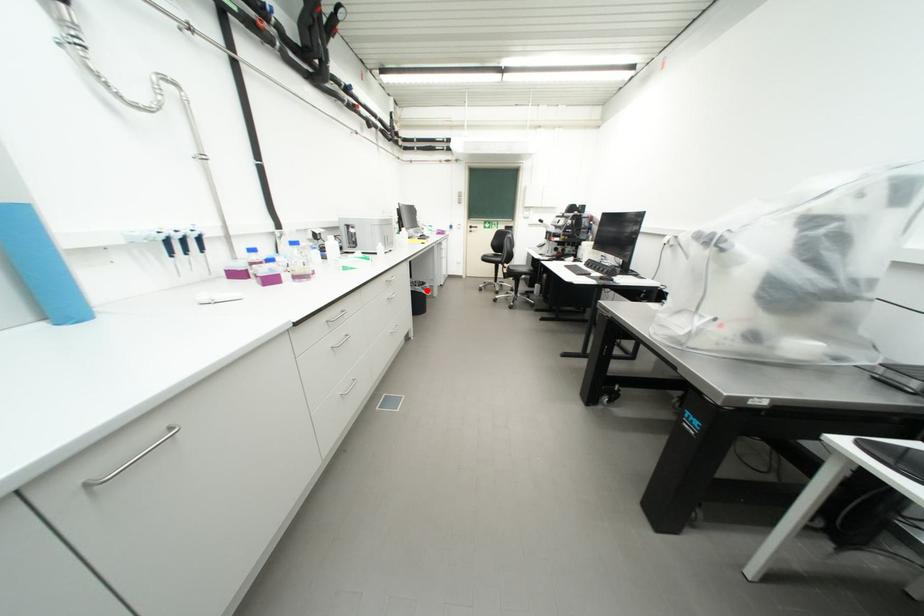
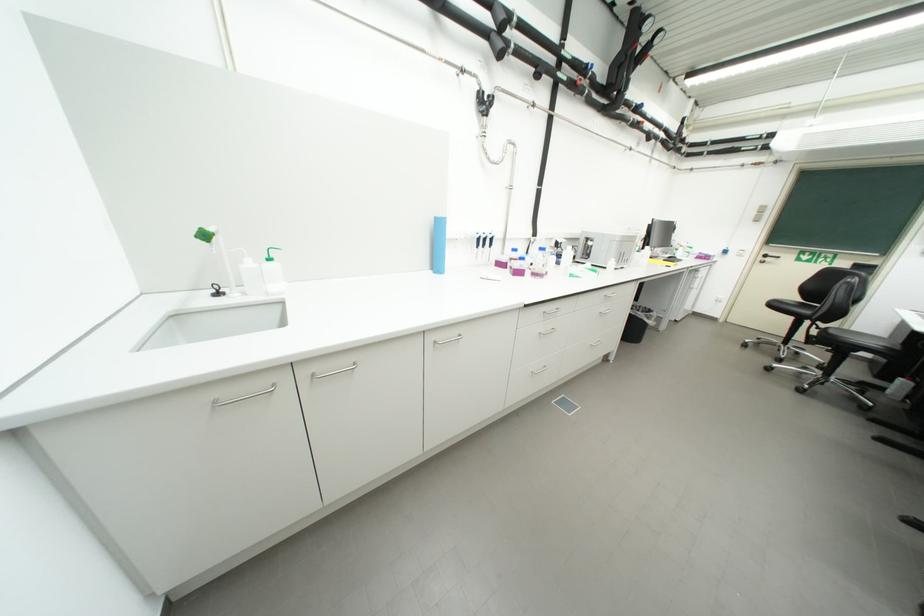
Question: A red point is marked in image1. In image2, is the corresponding 3D point closer to the camera or farther? Reply with the corresponding letter.

Choices:
 (A) The corresponding 3D point is closer.
 (B) The corresponding 3D point is farther.

Answer: (B)